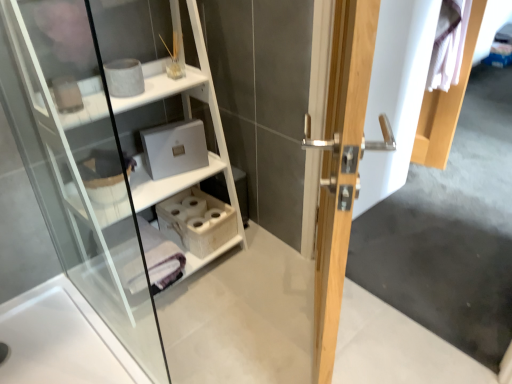
Question: Would you say wooden tissue box at lower center contains white wood shelf at upper left?

Choices:
 (A) no
 (B) yes

Answer: (A)

Question: Is wooden tissue box at lower center located outside white wood shelf at upper left?

Choices:
 (A) no
 (B) yes

Answer: (A)

Question: Is wooden tissue box at lower center smaller than white wood shelf at upper left?

Choices:
 (A) no
 (B) yes

Answer: (B)

Question: Is wooden tissue box at lower center touching white wood shelf at upper left?

Choices:
 (A) no
 (B) yes

Answer: (A)

Question: Is wooden tissue box at lower center aimed at white wood shelf at upper left?

Choices:
 (A) yes
 (B) no

Answer: (A)

Question: Can you confirm if wooden tissue box at lower center is positioned to the left of white wood shelf at upper left?

Choices:
 (A) no
 (B) yes

Answer: (A)

Question: Can you confirm if light wood door handle at center is taller than wooden tissue box at lower center?

Choices:
 (A) yes
 (B) no

Answer: (A)

Question: Does light wood door handle at center have a smaller size compared to wooden tissue box at lower center?

Choices:
 (A) no
 (B) yes

Answer: (A)

Question: Is light wood door handle at center wider than wooden tissue box at lower center?

Choices:
 (A) no
 (B) yes

Answer: (A)

Question: Is light wood door handle at center not within wooden tissue box at lower center?

Choices:
 (A) no
 (B) yes

Answer: (B)

Question: Is light wood door handle at center at the left side of wooden tissue box at lower center?

Choices:
 (A) yes
 (B) no

Answer: (B)

Question: Are light wood door handle at center and wooden tissue box at lower center beside each other?

Choices:
 (A) yes
 (B) no

Answer: (B)

Question: From the image's perspective, does wooden tissue box at lower center appear higher than light wood door handle at center?

Choices:
 (A) yes
 (B) no

Answer: (B)